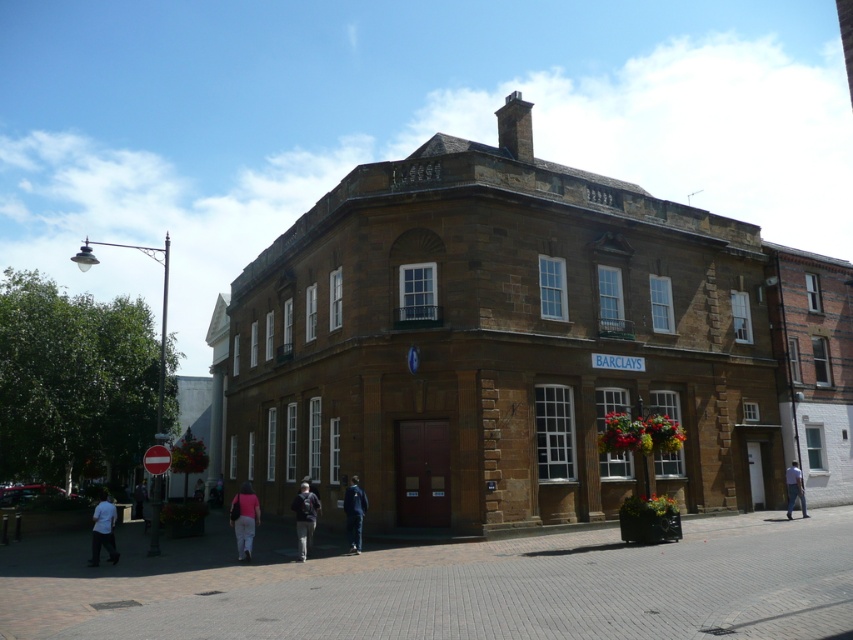
You are a delivery person trying to place a package on the ground in front of the historic building. There are two fabrics on the ground near the Barclays sign. The white fabric at lower left and the pink fabric at lower center. Which fabric is closer to the Barclays sign?

The pink fabric at lower center is closer to the Barclays sign because it is positioned lower than the white fabric at lower left.

You are standing on the paved walkway in front of the historic building. You see denim pants at lower right and pink fabric at lower center. Which object is positioned higher from the ground?

The denim pants at lower right is located above the pink fabric at lower center, so it is positioned higher from the ground.